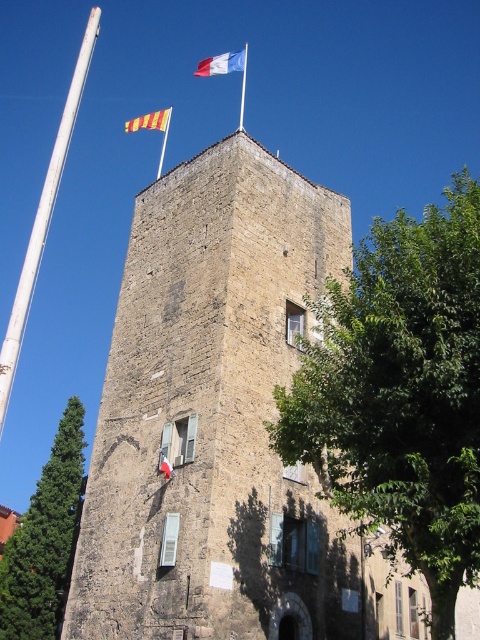
You are standing in front of the tower and want to hang a new flag between the white metallic pole at left and the red fabric flag at upper center. Based on their positions, where should you place the new flag?

The white metallic pole at left is to the left of the red fabric flag at upper center, so you should place the new flag between them along the horizontal axis, to the right of the white metallic pole at left and to the left of the red fabric flag at upper center.

You are standing in front of the stone tower and want to determine which of the two points, point (324, 355) or point (247, 45), is closer to you. Based on the image, which point is nearer?

Point (324, 355) is closer to the viewer than point (247, 45).

You are standing at the coordinates 0,0 and want to reach the brown stone tower at center. Which direction should you move in to get there?

Since the brown stone tower at center is located at coordinates (213, 417), you should move towards the northeast direction to reach it.